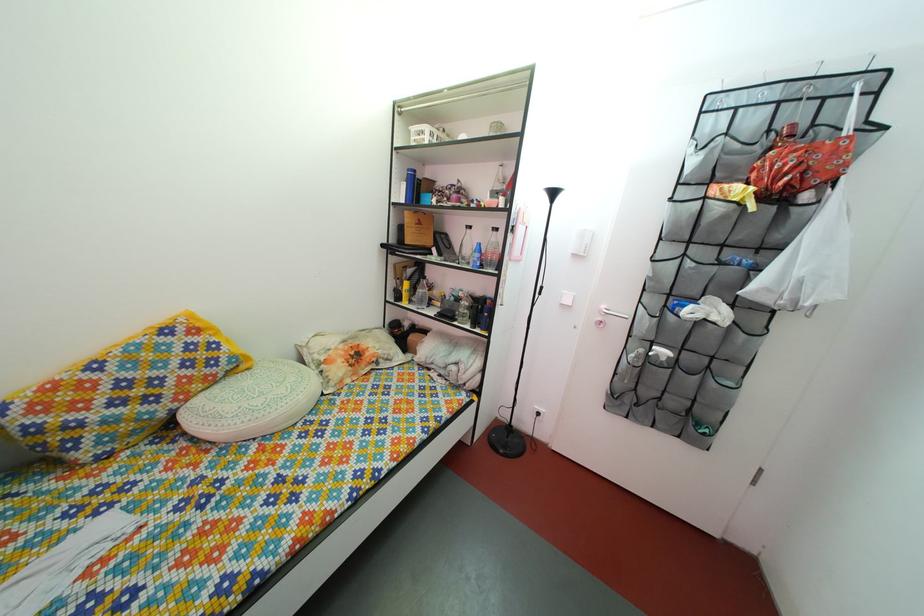
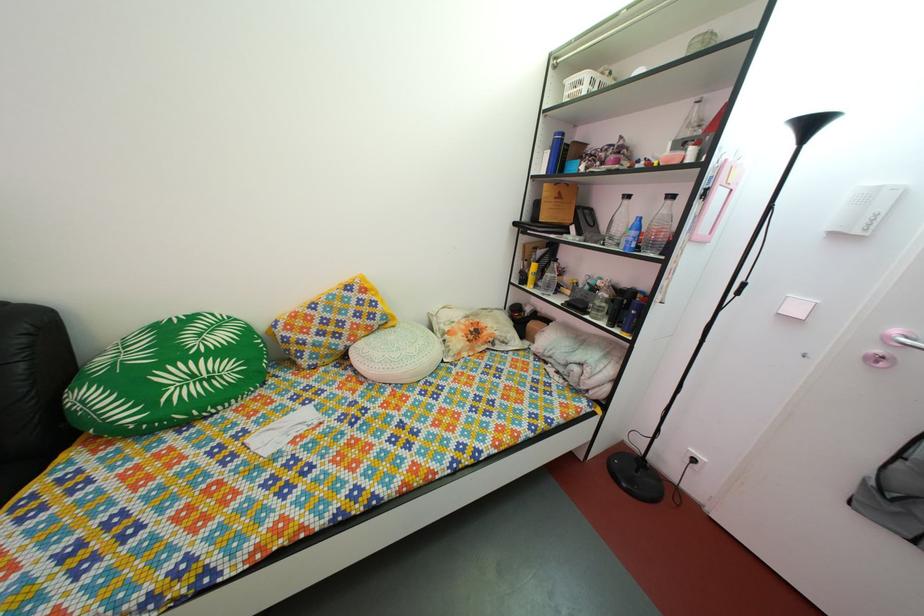
Where in the second image is the point corresponding to point (421, 138) from the first image?

(578, 91)